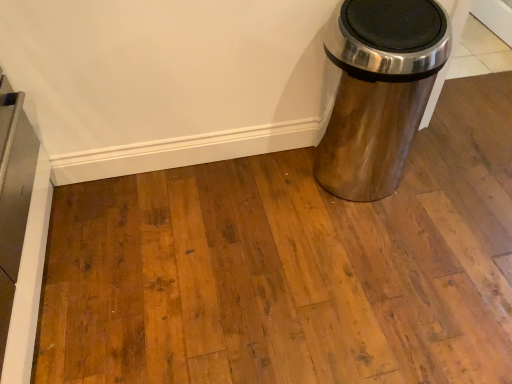
Where is `free region under polished stainless steel trash can at right (from a real-world perspective)`? This screenshot has height=384, width=512. free region under polished stainless steel trash can at right (from a real-world perspective) is located at coordinates (358, 177).